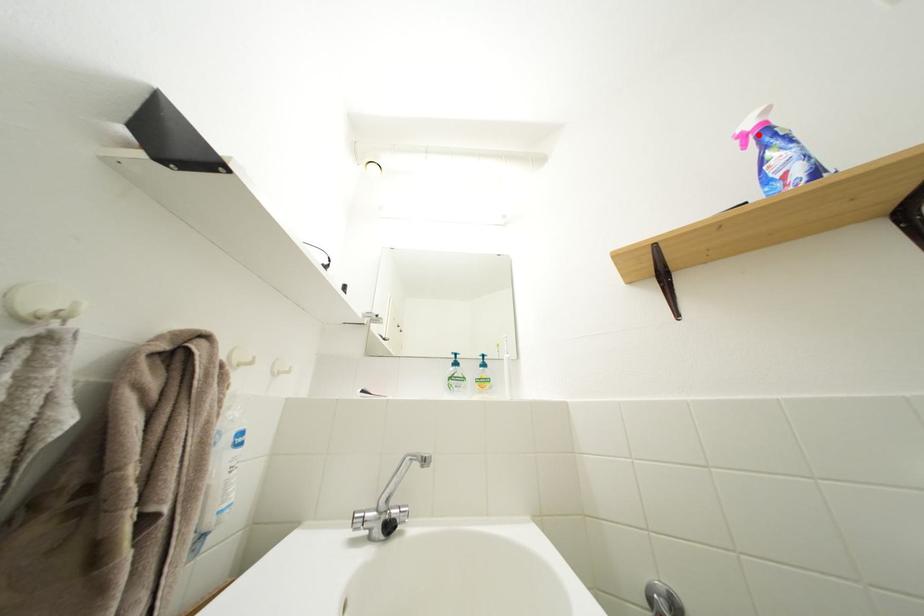
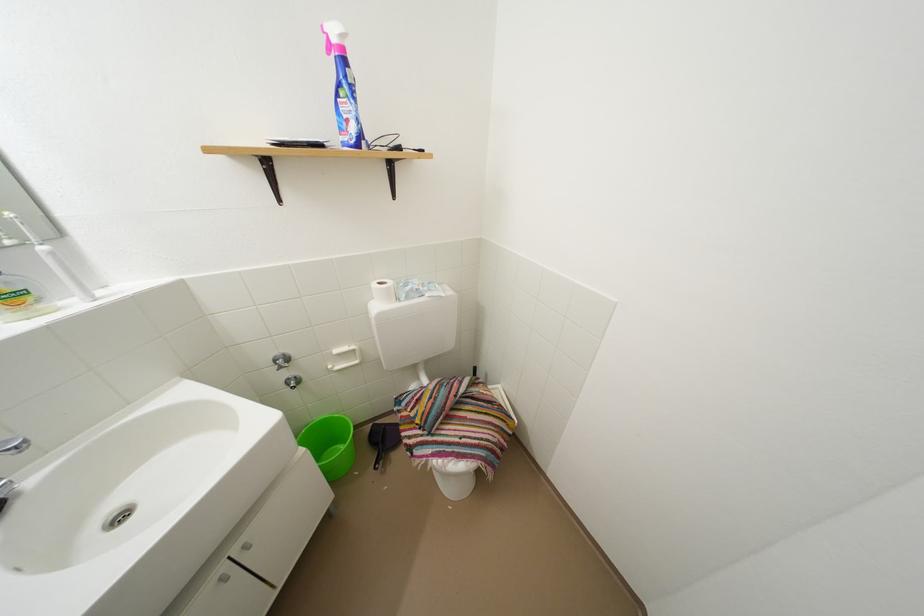
The point at the highlighted location is marked in the first image. Where is the corresponding point in the second image?

(342, 45)